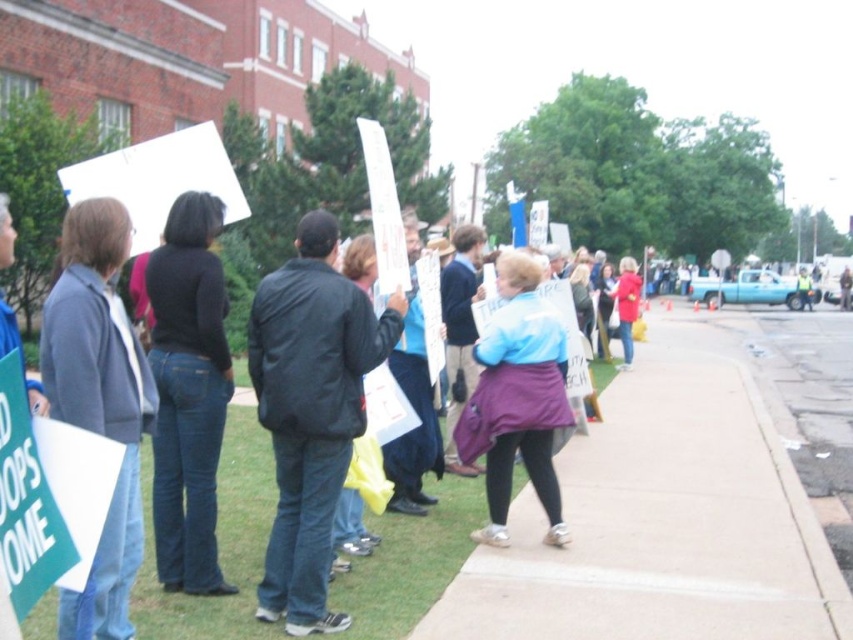
Which is below, matte black jacket at center or gray wool sweater at left?

matte black jacket at center

Consider the image. Which of these two, matte black jacket at center or gray wool sweater at left, stands taller?

Standing taller between the two is gray wool sweater at left.

Who is more distant from viewer, (225,461) or (44,304)?

Point (225,461)

You are a GUI agent. You are given a task and a screenshot of the screen. Output one action in this format:
    pyautogui.click(x=<x>, y=<y>)
    Task: Click on the matte black jacket at center
    The image size is (853, 640).
    Given the screenshot: What is the action you would take?
    pyautogui.click(x=218, y=544)

Is point (294, 320) positioned in front of point (498, 390)?

Yes, point (294, 320) is closer to viewer.

Does point (331, 273) lie behind point (544, 349)?

No, it is in front of (544, 349).

Identify the location of black leather jacket at center. (311, 412).

Between point (788, 621) and point (239, 620), which one is positioned in front?

Point (239, 620) is more forward.

Is paved concrete sidewalk at center thinner than matte black jacket at center?

No.

Does point (709, 362) come behind point (48, 625)?

Yes.

Where is `paved concrete sidewalk at center`? The width and height of the screenshot is (853, 640). paved concrete sidewalk at center is located at coordinates (665, 513).